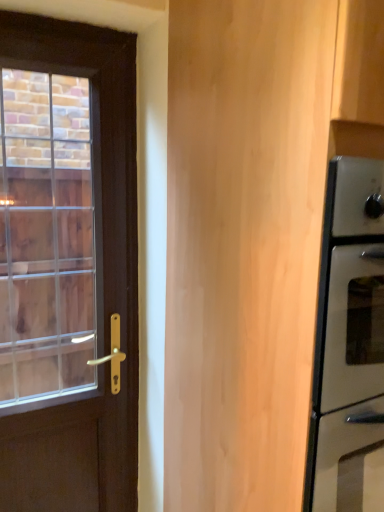
Measure the distance between light wood/texture barn door at center and camera.

light wood/texture barn door at center and camera are 62.07 centimeters apart.

The height and width of the screenshot is (512, 384). Identify the location of light wood/texture barn door at center. 243,246.

This screenshot has height=512, width=384. Describe the element at coordinates (243, 246) in the screenshot. I see `light wood/texture barn door at center` at that location.

What are the coordinates of `light wood/texture barn door at center` in the screenshot? It's located at (243, 246).